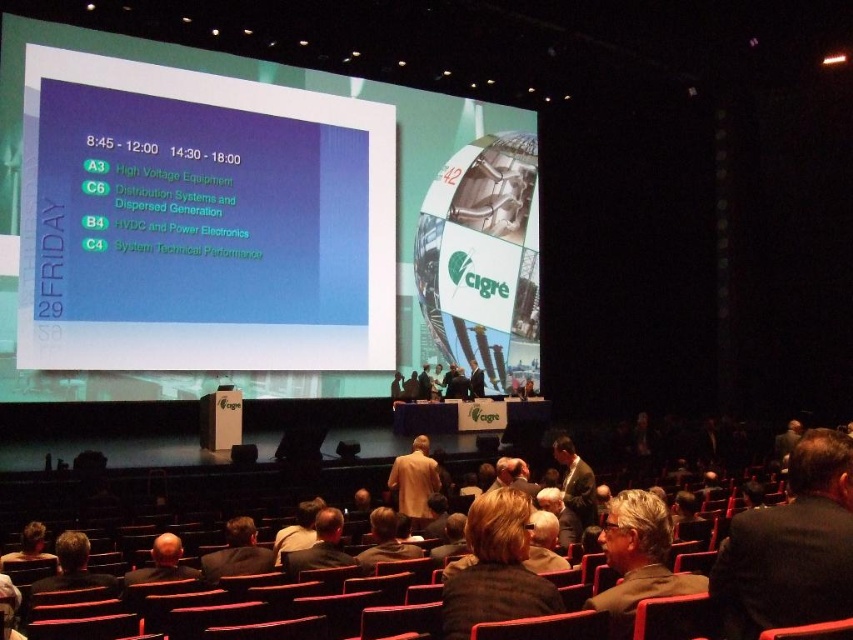
Question: Observing the image, what is the correct spatial positioning of black suit at center in reference to dark brown hair at lower left?

Choices:
 (A) above
 (B) below

Answer: (A)

Question: Among these points, which one is nearest to the camera?

Choices:
 (A) (351, 314)
 (B) (125, 582)
 (C) (314, 524)
 (D) (764, 625)

Answer: (D)

Question: Is dark suit at center thinner than light brown suit at lower right?

Choices:
 (A) yes
 (B) no

Answer: (B)

Question: Which point is closer to the camera taking this photo?

Choices:
 (A) (74, 544)
 (B) (22, 532)
 (C) (628, 592)

Answer: (C)

Question: Is dark suit at center to the left of black suit at center from the viewer's perspective?

Choices:
 (A) no
 (B) yes

Answer: (A)

Question: Which point is closer to the camera?

Choices:
 (A) dark brown hair at lower center
 (B) dark suit at center
 (C) black suit at center

Answer: (B)